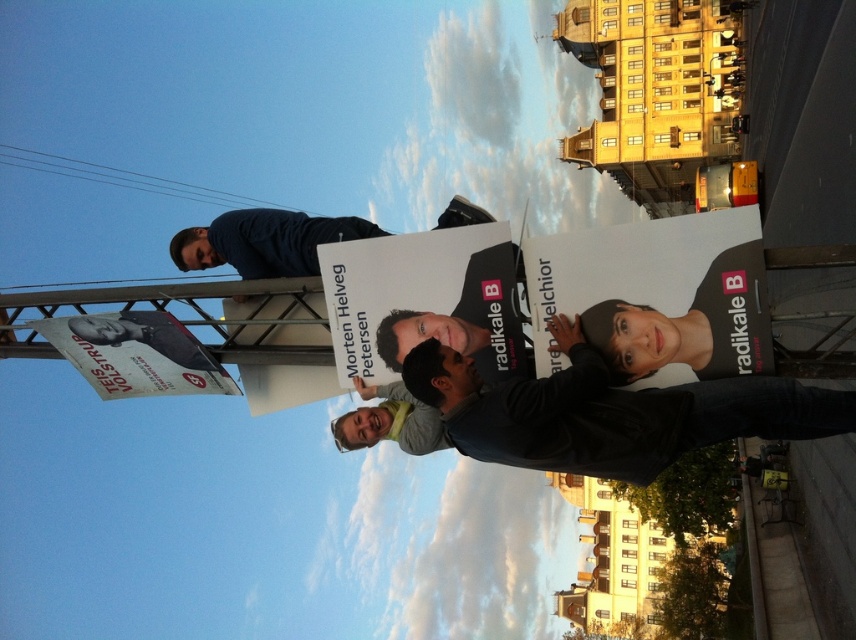
Question: Which point is farther to the camera?

Choices:
 (A) matte black poster at upper left
 (B) dark gray hoodie at center
 (C) matte black poster at center

Answer: (A)

Question: Is white paper poster at center below matte black poster at upper left?

Choices:
 (A) yes
 (B) no

Answer: (B)

Question: Does white paper poster at left have a larger size compared to matte black poster at upper left?

Choices:
 (A) no
 (B) yes

Answer: (B)

Question: Which object is farther from the camera taking this photo?

Choices:
 (A) matte black poster at center
 (B) white paper poster at left
 (C) matte black poster at upper left
 (D) dark gray hoodie at center

Answer: (C)

Question: Can you confirm if dark gray hoodie at center is smaller than white paper poster at left?

Choices:
 (A) yes
 (B) no

Answer: (B)

Question: Considering the real-world distances, which object is farthest from the white paper poster at center?

Choices:
 (A) matte black poster at upper left
 (B) matte black poster at center
 (C) dark gray hoodie at center

Answer: (A)